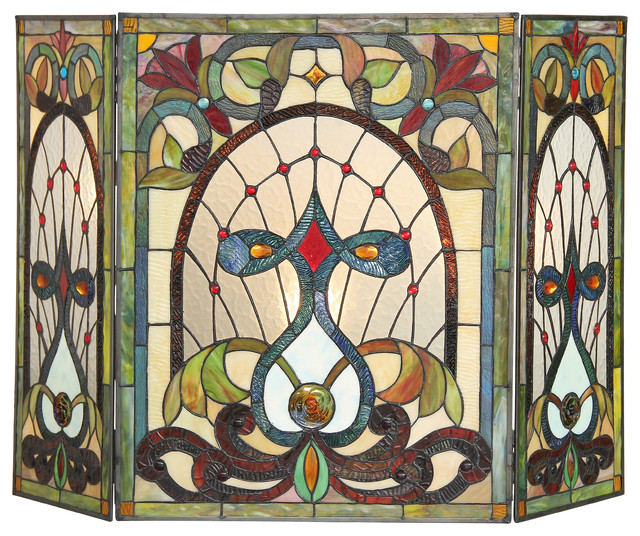
The image size is (640, 536). Identify the location of gold stained glass. (484, 41).